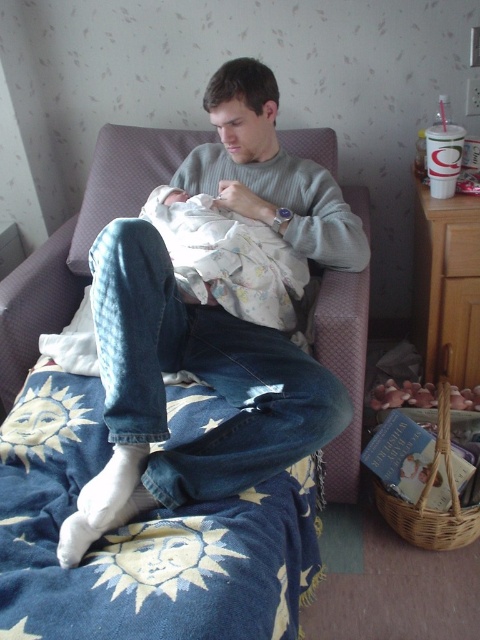
You are a photographer setting up a shot of the man and the baby. The blue embroidered blanket at lower left is part of the scene. Where exactly should you position the camera to ensure the blanket is in the lower left corner of the photo?

The blue embroidered blanket at lower left is located at point (142, 540), so position the camera so that the blanket is at the lower left corner of the photo by aligning it with coordinates close to those coordinates.

You are a photographer setting up a shoot in this scene. You need to place a small prop between the blue embroidered blanket at lower left and the denim jeans at center. Based on their positions, where should the prop be placed?

The blue embroidered blanket at lower left is below the denim jeans at center, so the prop should be placed between them in the space that is above the blue embroidered blanket at lower left and below the denim jeans at center.

You are a photographer setting up a shoot in this scene. You want to ensure the blue embroidered blanket at lower left and the denim jeans at center are both visible in the final photo. Based on their positions, which object should you focus on first to ensure both are in frame?

The blue embroidered blanket at lower left is in front of the denim jeans at center, so focusing on the blue embroidered blanket at lower left first will help ensure both objects remain visible in the frame.